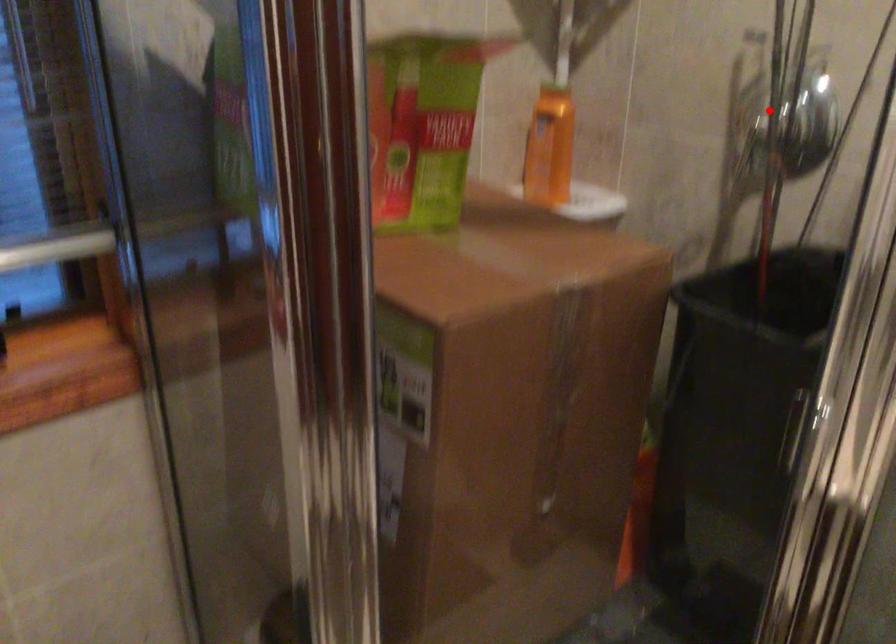
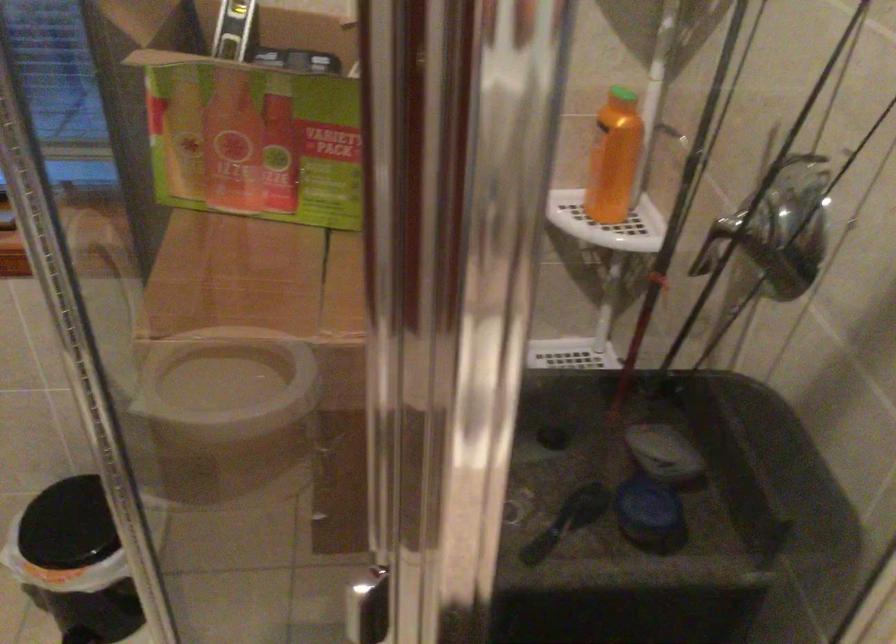
The point at the highlighted location is marked in the first image. Where is the corresponding point in the second image?

(676, 212)